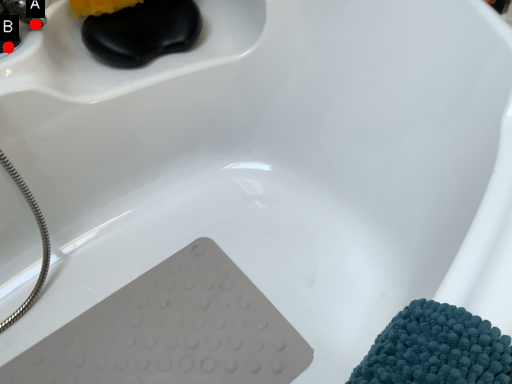
Question: Two points are circled on the image, labeled by A and B beside each circle. Which point is farther to the camera?

Choices:
 (A) A is further
 (B) B is further

Answer: (A)